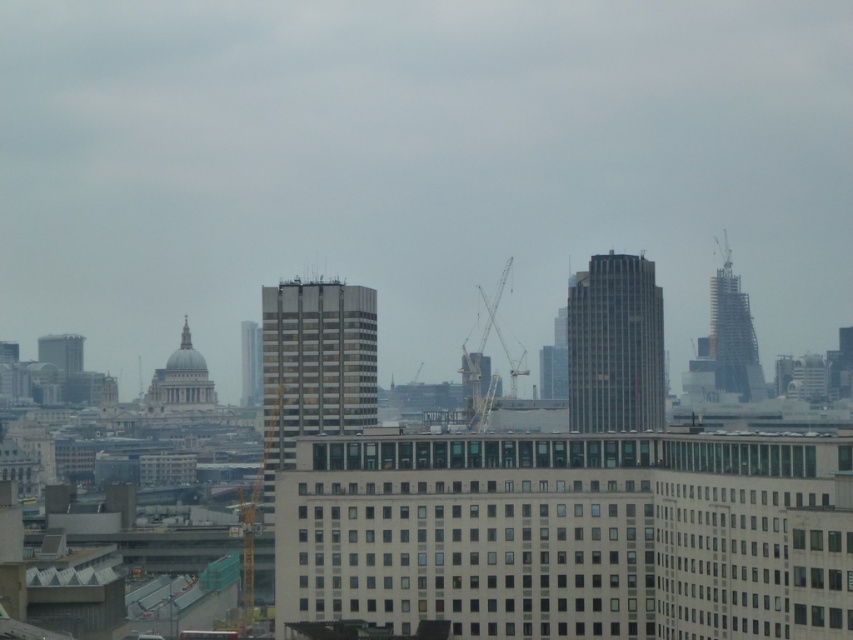
Question: Which of the following is the farthest from the observer?

Choices:
 (A) matte glass skyscraper at upper left
 (B) metallic gray crane at center
 (C) matte glass building at center

Answer: (A)

Question: Which point appears closest to the camera in this image?

Choices:
 (A) (474, 397)
 (B) (70, 336)
 (C) (251, 342)

Answer: (A)

Question: Is gray glass skyscraper at center to the left of smooth glass skyscraper at center from the viewer's perspective?

Choices:
 (A) no
 (B) yes

Answer: (A)

Question: Which object is farther from the camera taking this photo?

Choices:
 (A) gray glass skyscraper at center
 (B) glassy steel tower at right

Answer: (B)

Question: Is gray glass skyscraper at center in front of smooth glass skyscraper at center?

Choices:
 (A) yes
 (B) no

Answer: (A)

Question: Is gray glass skyscraper at center in front of glassy steel tower at right?

Choices:
 (A) yes
 (B) no

Answer: (A)